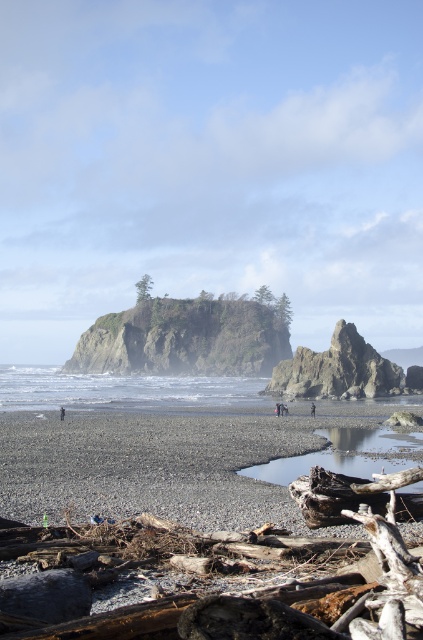
Between rough rock cliff at center and rough textured rock formation at center, which one has less height?

Standing shorter between the two is rough textured rock formation at center.

Does rough rock cliff at center appear under rough textured rock formation at center?

Actually, rough rock cliff at center is above rough textured rock formation at center.

Is point (222, 364) farther from camera compared to point (359, 392)?

Yes, it is behind point (359, 392).

Find the location of a particular element. rough rock cliff at center is located at coordinates coord(186,337).

Which is behind, point (230, 512) or point (62, 419)?

Positioned behind is point (62, 419).

Locate an element on the screen. smooth pebbles at lower left is located at coordinates (156, 465).

This screenshot has width=423, height=640. Find the location of `smooth pebbles at lower left`. smooth pebbles at lower left is located at coordinates (156, 465).

The image size is (423, 640). What are the coordinates of `smooth pebbles at lower left` in the screenshot? It's located at (156, 465).

In the scene shown: Between smooth pebbles at lower left and rough rock cliff at center, which one appears on the right side from the viewer's perspective?

From the viewer's perspective, smooth pebbles at lower left appears more on the right side.

Is smooth pebbles at lower left wider than rough rock cliff at center?

Incorrect, smooth pebbles at lower left's width does not surpass rough rock cliff at center's.

This screenshot has width=423, height=640. What do you see at coordinates (156, 465) in the screenshot?
I see `smooth pebbles at lower left` at bounding box center [156, 465].

The height and width of the screenshot is (640, 423). I want to click on smooth pebbles at lower left, so click(x=156, y=465).